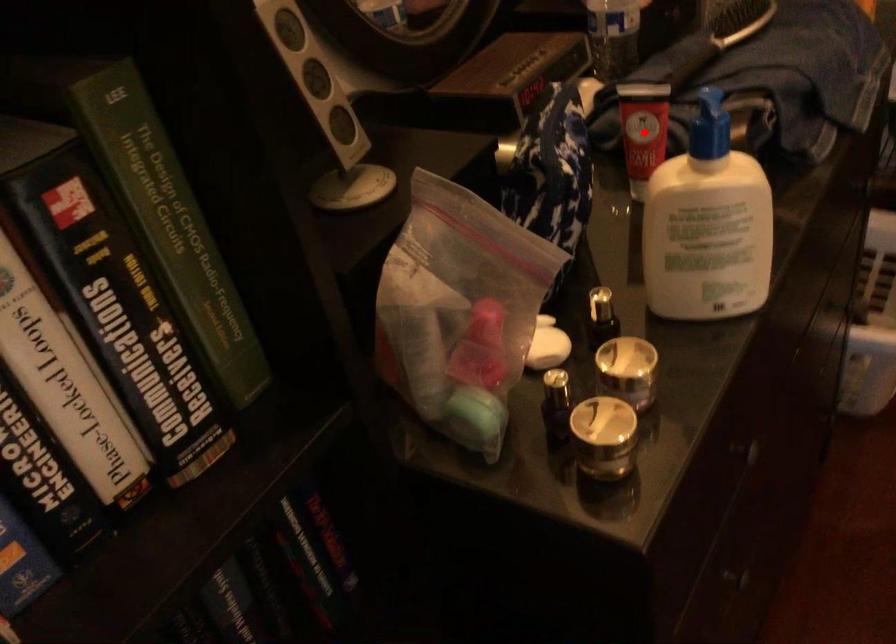
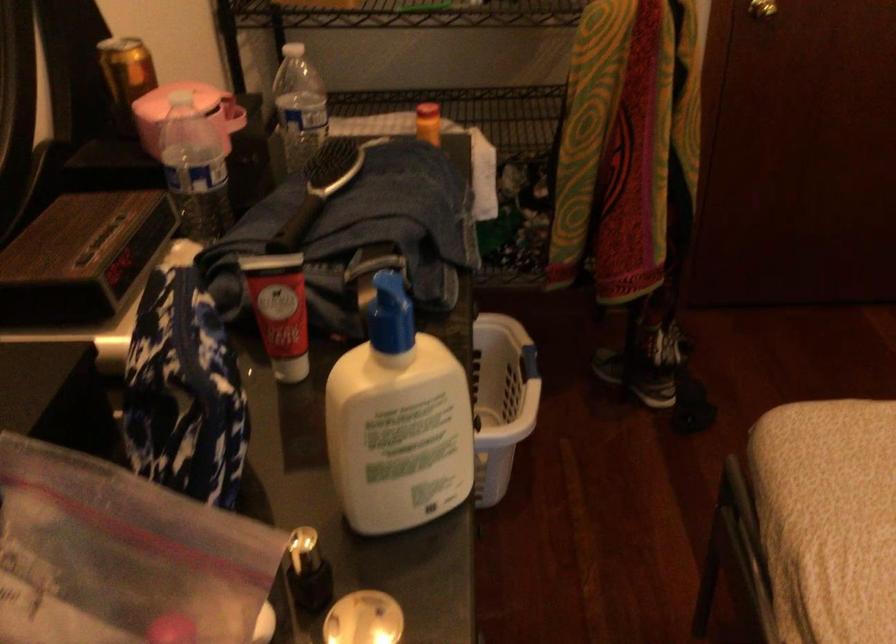
Question: I am providing you with two images of the same scene from different viewpoints. In image1, a red point is highlighted. Considering the same 3D point in image2, which of the following is correct?

Choices:
 (A) It is closer
 (B) It is farther

Answer: (A)